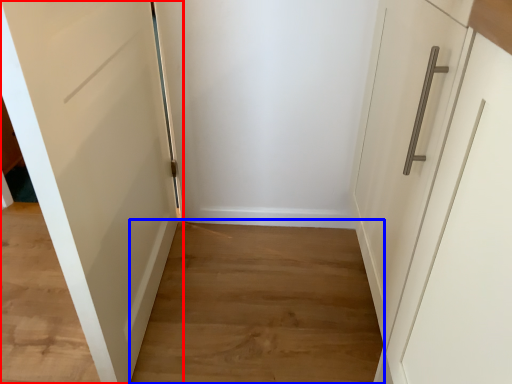
Question: Which object appears farthest to the camera in this image, door (highlighted by a red box) or path (highlighted by a blue box)?

Choices:
 (A) door
 (B) path

Answer: (B)